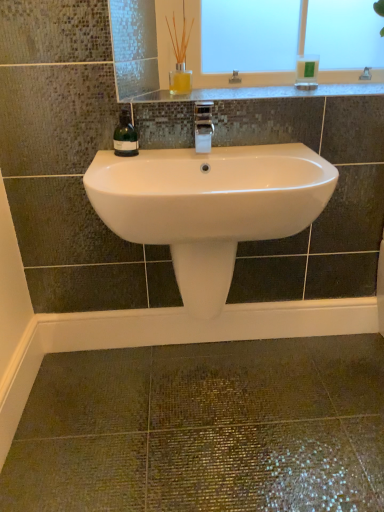
Find the location of a particular element. green glass bottle at left is located at coordinates (125, 136).

What do you see at coordinates (209, 206) in the screenshot?
I see `white glossy sink at center` at bounding box center [209, 206].

Identify the location of white ceramic faucet at center. The height and width of the screenshot is (512, 384). (203, 126).

This screenshot has height=512, width=384. I want to click on green glass bottle at left, so click(125, 136).

Which of these two, granite countertop at upper center or white ceramic faucet at center, is smaller?

white ceramic faucet at center.

Does point (251, 90) lie in front of point (210, 136)?

No, (251, 90) is further to viewer.

Between granite countertop at upper center and white ceramic faucet at center, which one appears on the left side from the viewer's perspective?

white ceramic faucet at center.

From the image's perspective, is granite countertop at upper center located beneath white ceramic faucet at center?

Actually, granite countertop at upper center appears above white ceramic faucet at center in the image.

Does green plastic soap dispenser at upper right have a smaller size compared to granite countertop at upper center?

Correct, green plastic soap dispenser at upper right occupies less space than granite countertop at upper center.

Is green plastic soap dispenser at upper right shorter than granite countertop at upper center?

No.

Is green plastic soap dispenser at upper right directly adjacent to granite countertop at upper center?

green plastic soap dispenser at upper right and granite countertop at upper center are clearly separated.

Is the position of green plastic soap dispenser at upper right more distant than that of granite countertop at upper center?

Yes, the depth of green plastic soap dispenser at upper right is greater than that of granite countertop at upper center.

Which of these two, translucent glass vase at upper center or green plastic soap dispenser at upper right, is smaller?

green plastic soap dispenser at upper right.

Which is correct: translucent glass vase at upper center is inside green plastic soap dispenser at upper right, or outside of it?

translucent glass vase at upper center is located beyond the bounds of green plastic soap dispenser at upper right.

Is translucent glass vase at upper center placed right next to green plastic soap dispenser at upper right?

translucent glass vase at upper center is not next to green plastic soap dispenser at upper right, and they're not touching.

Consider the image. From a real-world perspective, who is located higher, translucent glass vase at upper center or green plastic soap dispenser at upper right?

translucent glass vase at upper center.

Which is closer to the camera, (155, 208) or (298, 78)?

The point (155, 208) is more forward.

Does white glossy sink at center have a greater height compared to green plastic soap dispenser at upper right?

Yes, white glossy sink at center is taller than green plastic soap dispenser at upper right.

Do you think white glossy sink at center is within green plastic soap dispenser at upper right, or outside of it?

white glossy sink at center cannot be found inside green plastic soap dispenser at upper right.

Can you see white glossy sink at center touching green plastic soap dispenser at upper right?

No, white glossy sink at center is not next to green plastic soap dispenser at upper right.

From the image's perspective, which one is positioned lower, green plastic soap dispenser at upper right or white glossy sink at center?

white glossy sink at center, from the image's perspective.

Between green plastic soap dispenser at upper right and white glossy sink at center, which one has more height?

With more height is white glossy sink at center.

Based on the photo, in the image, is green plastic soap dispenser at upper right on the left side or the right side of white glossy sink at center?

green plastic soap dispenser at upper right is positioned on white glossy sink at center's right side.

Is translucent glass vase at upper center far away from white glossy sink at center?

No.

Based on the photo, which of these two, translucent glass vase at upper center or white glossy sink at center, stands taller?

white glossy sink at center.

Is white glossy sink at center surrounded by translucent glass vase at upper center?

No, white glossy sink at center is not surrounded by translucent glass vase at upper center.

From the image's perspective, which one is positioned higher, translucent glass vase at upper center or white glossy sink at center?

From the image's view, translucent glass vase at upper center is above.

From their relative heights in the image, would you say white glossy sink at center is taller or shorter than granite countertop at upper center?

white glossy sink at center is taller than granite countertop at upper center.

Does point (205, 270) come behind point (243, 99)?

No, it is in front of (243, 99).

From a real-world perspective, is white glossy sink at center on granite countertop at upper center?

No.

Is white glossy sink at center closer to camera compared to granite countertop at upper center?

Yes.

At what (x,y) coordinates should I click in order to perform the action: click on counter top that is above the white ceramic faucet at center (from the image's perspective). Please return your answer as a coordinate pair (x, y). The width and height of the screenshot is (384, 512). Looking at the image, I should click on (260, 93).

Image resolution: width=384 pixels, height=512 pixels. Find the location of `toiletry that is behind the granite countertop at upper center`. toiletry that is behind the granite countertop at upper center is located at coordinates (307, 72).

From the image, which object appears to be nearer to green plastic soap dispenser at upper right, white glossy sink at center or granite countertop at upper center?

Based on the image, granite countertop at upper center appears to be nearer to green plastic soap dispenser at upper right.

From the image, which object appears to be farther from green plastic soap dispenser at upper right, white ceramic faucet at center or green glass bottle at left?

green glass bottle at left is positioned further to the anchor green plastic soap dispenser at upper right.

Considering their positions, is white ceramic faucet at center positioned closer to green plastic soap dispenser at upper right than white glossy sink at center?

white ceramic faucet at center lies closer to green plastic soap dispenser at upper right than the other object.

From the image, which object appears to be nearer to green plastic soap dispenser at upper right, translucent glass vase at upper center or white glossy sink at center?

Based on the image, translucent glass vase at upper center appears to be nearer to green plastic soap dispenser at upper right.

When comparing their distances from white glossy sink at center, does translucent glass vase at upper center or granite countertop at upper center seem further?

The object further to white glossy sink at center is translucent glass vase at upper center.

Looking at the image, which one is located closer to white ceramic faucet at center, granite countertop at upper center or translucent glass vase at upper center?

Based on the image, granite countertop at upper center appears to be nearer to white ceramic faucet at center.

When comparing their distances from green plastic soap dispenser at upper right, does granite countertop at upper center or translucent glass vase at upper center seem closer?

granite countertop at upper center lies closer to green plastic soap dispenser at upper right than the other object.

From the image, which object appears to be nearer to white glossy sink at center, green plastic soap dispenser at upper right or granite countertop at upper center?

granite countertop at upper center is closer to white glossy sink at center.

Image resolution: width=384 pixels, height=512 pixels. Identify the location of wine bottle between granite countertop at upper center and white glossy sink at center from top to bottom. (125, 136).

Locate an element on the screen. The image size is (384, 512). plumbing fixture between translucent glass vase at upper center and green glass bottle at left vertically is located at coordinates (203, 126).

I want to click on wine bottle between green plastic soap dispenser at upper right and white glossy sink at center vertically, so click(x=125, y=136).

Locate an element on the screen. Image resolution: width=384 pixels, height=512 pixels. plumbing fixture between translucent glass vase at upper center and granite countertop at upper center is located at coordinates (203, 126).